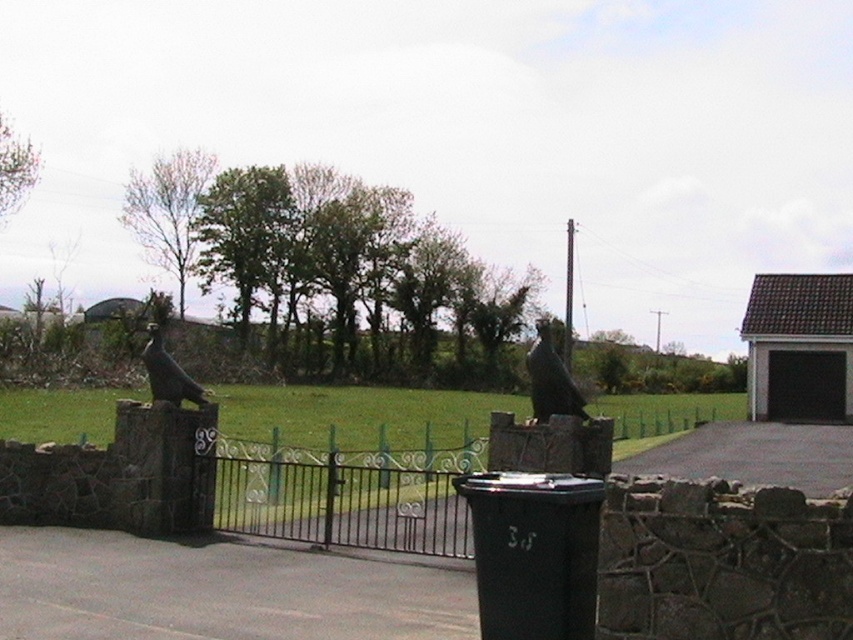
Question: Is black wrought iron gate at center to the left of matte black bird at left from the viewer's perspective?

Choices:
 (A) no
 (B) yes

Answer: (A)

Question: Which object is closer to the camera taking this photo?

Choices:
 (A) polished bronze eagle at center
 (B) black wrought iron gate at center

Answer: (B)

Question: Is black wrought iron gate at center thinner than polished bronze eagle at center?

Choices:
 (A) yes
 (B) no

Answer: (B)

Question: Does black wrought iron gate at center appear under matte black bird at left?

Choices:
 (A) yes
 (B) no

Answer: (A)

Question: Which point is closer to the camera?

Choices:
 (A) (428, 465)
 (B) (534, 353)
 (C) (151, 362)

Answer: (B)

Question: Among these objects, which one is nearest to the camera?

Choices:
 (A) matte black bird at left
 (B) black wrought iron gate at center
 (C) polished bronze eagle at center

Answer: (B)